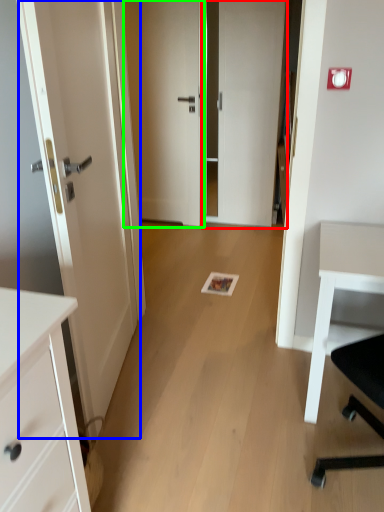
Question: Based on their relative distances, which object is farther from door (highlighted by a red box)? Choose from door (highlighted by a blue box) and door (highlighted by a green box).

Choices:
 (A) door
 (B) door

Answer: (A)